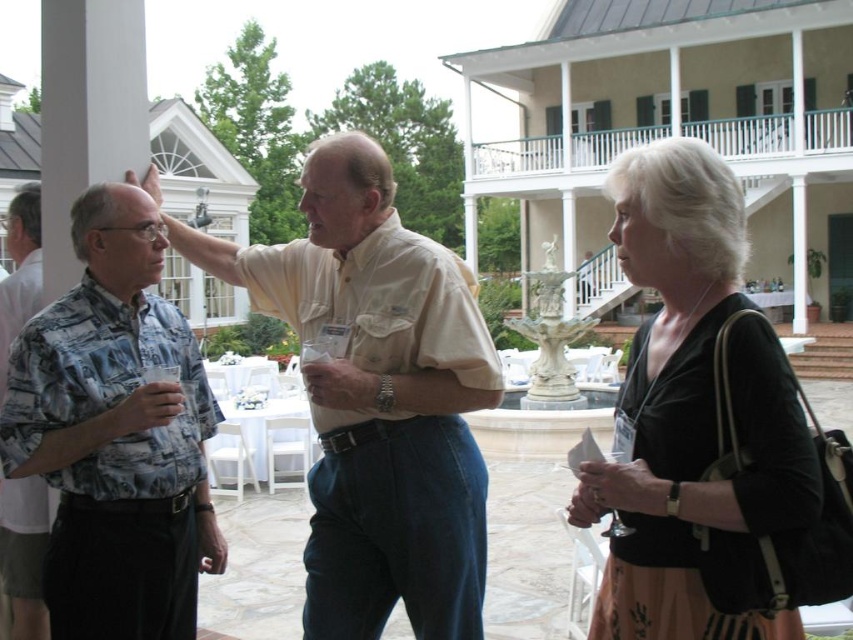
Looking at this image, you are standing at the entrance of the event and see the light beige cotton shirt at center and the white wooden porch at upper center. Which object is taller?

The light beige cotton shirt at center is taller than the white wooden porch at upper center.

You are a photographer at the event and want to ensure both the black velvet dress at center and the printed fabric shirt at left are visible in your photo. Given their sizes, which one might you need to position closer to the camera to maintain clarity?

The printed fabric shirt at left is smaller in size compared to the black velvet dress at center. To ensure both are clearly visible, you should position the printed fabric shirt at left closer to the camera since it is smaller and might appear too small if farther away.

Based on the photo, you are a guest at the event and want to sit on the white wooden porch at upper center. However, your printed fabric shirt at left might be too long. Can you sit without the shirt getting caught on the porch?

The white wooden porch at upper center is shorter than the printed fabric shirt at left, so the shirt is longer than the porch. Therefore, the shirt might get caught or hang over the edge of the porch when sitting.